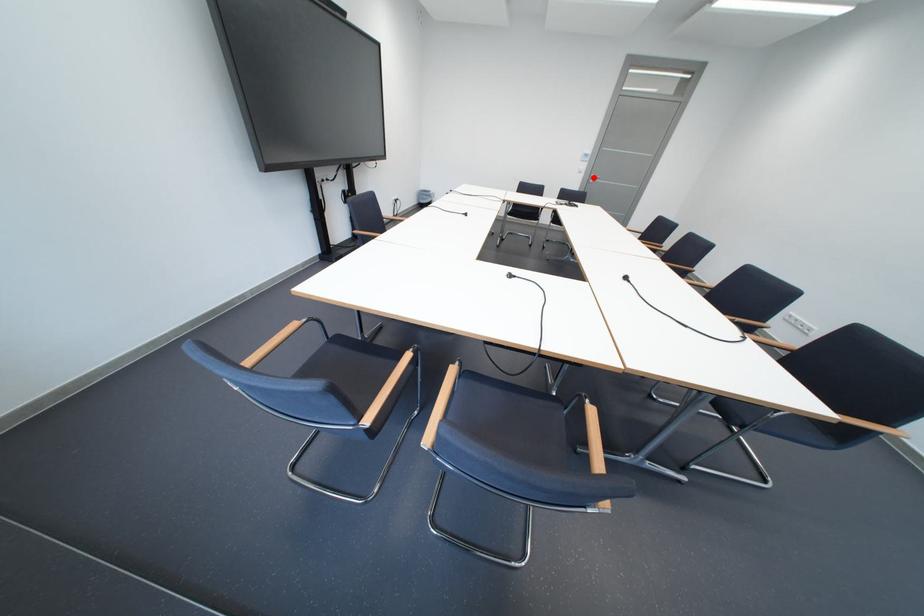
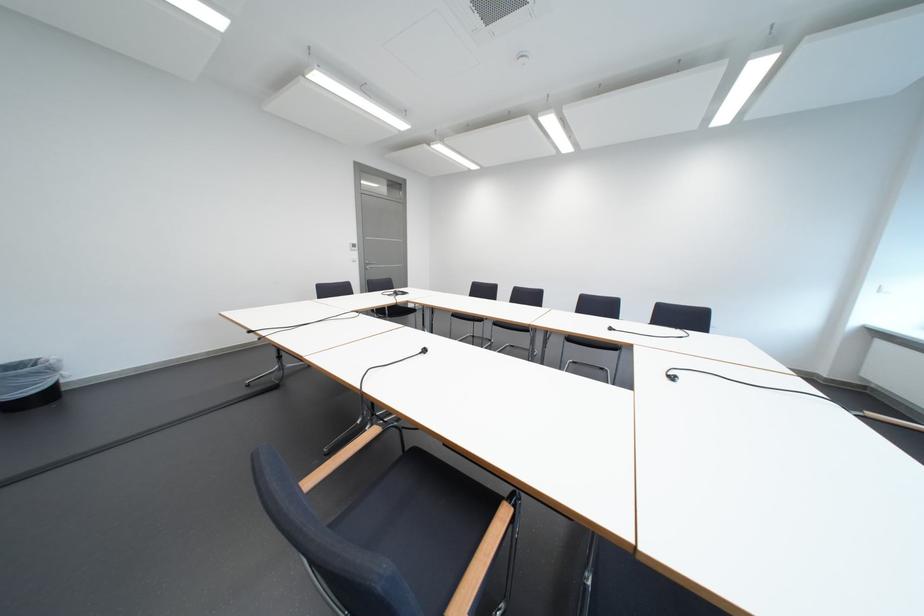
Locate, in the second image, the point that corresponds to the highlighted location in the first image.

(369, 265)